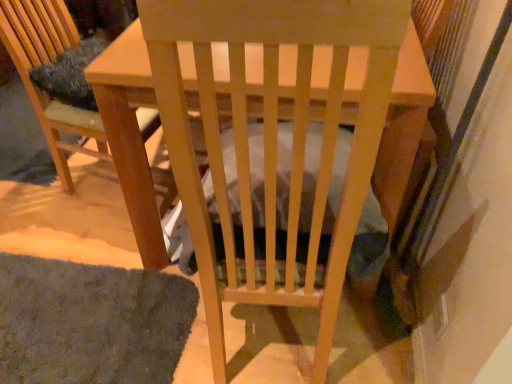
Question: Is wooden table at center next to green shaggy mat at lower left?

Choices:
 (A) no
 (B) yes

Answer: (A)

Question: Can you confirm if wooden table at center is positioned to the right of green shaggy mat at lower left?

Choices:
 (A) yes
 (B) no

Answer: (A)

Question: Is green shaggy mat at lower left completely or partially inside wooden table at center?

Choices:
 (A) no
 (B) yes

Answer: (A)

Question: Considering the relative sizes of wooden table at center and green shaggy mat at lower left in the image provided, is wooden table at center wider than green shaggy mat at lower left?

Choices:
 (A) no
 (B) yes

Answer: (B)

Question: Can you confirm if wooden table at center is positioned to the left of green shaggy mat at lower left?

Choices:
 (A) yes
 (B) no

Answer: (B)

Question: Is wooden chair at left situated inside green shaggy mat at lower left or outside?

Choices:
 (A) outside
 (B) inside

Answer: (A)

Question: Is wooden chair at left in front of or behind green shaggy mat at lower left in the image?

Choices:
 (A) behind
 (B) front

Answer: (A)

Question: In terms of height, does wooden chair at left look taller or shorter compared to green shaggy mat at lower left?

Choices:
 (A) tall
 (B) short

Answer: (A)

Question: In the image, is wooden chair at left on the left side or the right side of green shaggy mat at lower left?

Choices:
 (A) right
 (B) left

Answer: (A)

Question: In terms of width, does green shaggy mat at lower left look wider or thinner when compared to wooden table at center?

Choices:
 (A) thin
 (B) wide

Answer: (A)

Question: Considering the relative positions of green shaggy mat at lower left and wooden table at center in the image provided, is green shaggy mat at lower left to the left or to the right of wooden table at center?

Choices:
 (A) left
 (B) right

Answer: (A)

Question: From their relative heights in the image, would you say green shaggy mat at lower left is taller or shorter than wooden table at center?

Choices:
 (A) tall
 (B) short

Answer: (B)

Question: Does point (185, 283) appear closer or farther from the camera than point (373, 79)?

Choices:
 (A) closer
 (B) farther

Answer: (B)

Question: From their relative heights in the image, would you say green shaggy mat at lower left is taller or shorter than wooden chair at left?

Choices:
 (A) tall
 (B) short

Answer: (B)

Question: Does point (74, 274) appear closer or farther from the camera than point (49, 125)?

Choices:
 (A) closer
 (B) farther

Answer: (A)